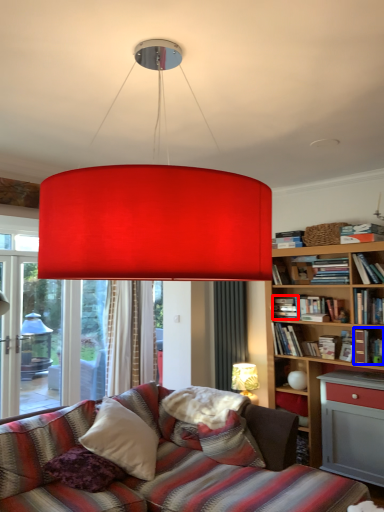
Question: Which object appears farthest to the camera in this image, book (highlighted by a red box) or book (highlighted by a blue box)?

Choices:
 (A) book
 (B) book

Answer: (A)